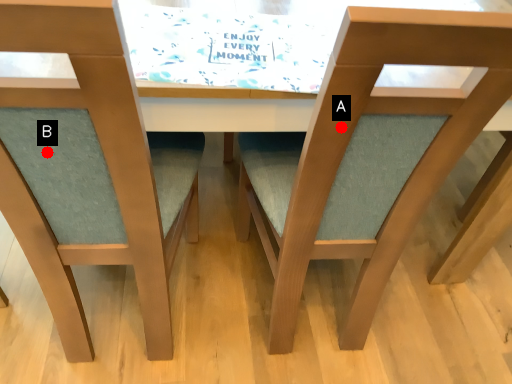
Question: Two points are circled on the image, labeled by A and B beside each circle. Which point is closer to the camera?

Choices:
 (A) A is closer
 (B) B is closer

Answer: (A)